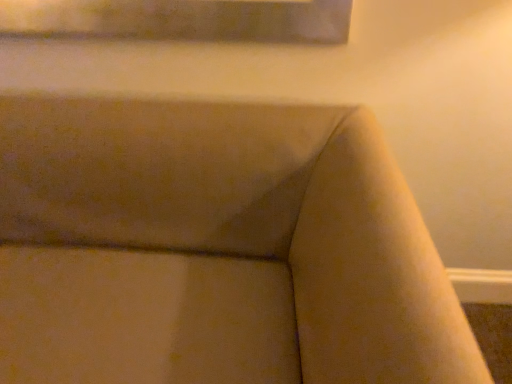
Measure the distance between beige fabric couch at center and camera.

They are 19.07 inches apart.

Locate an element on the screen. This screenshot has width=512, height=384. beige fabric couch at center is located at coordinates (216, 250).

What do you see at coordinates (216, 250) in the screenshot? This screenshot has width=512, height=384. I see `beige fabric couch at center` at bounding box center [216, 250].

Locate an element on the screen. The height and width of the screenshot is (384, 512). beige fabric couch at center is located at coordinates (216, 250).